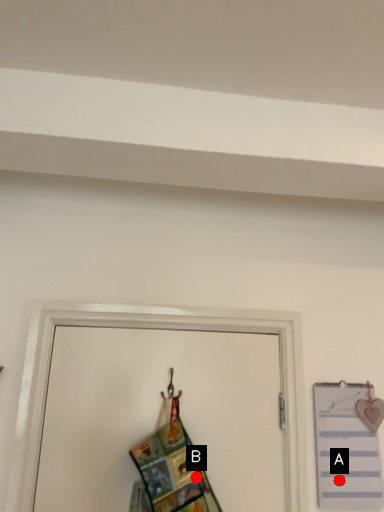
Question: Two points are circled on the image, labeled by A and B beside each circle. Which point is farther to the camera?

Choices:
 (A) A is further
 (B) B is further

Answer: (A)